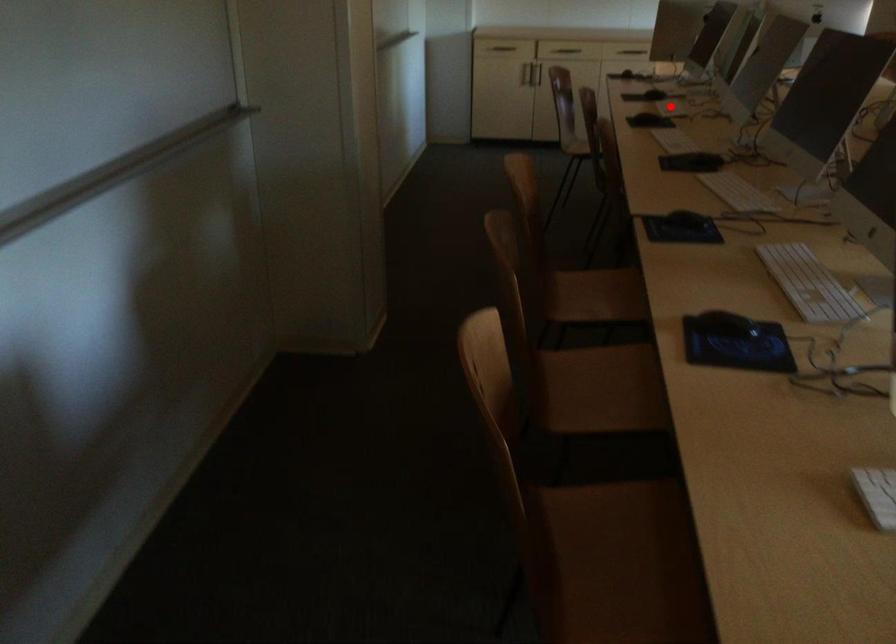
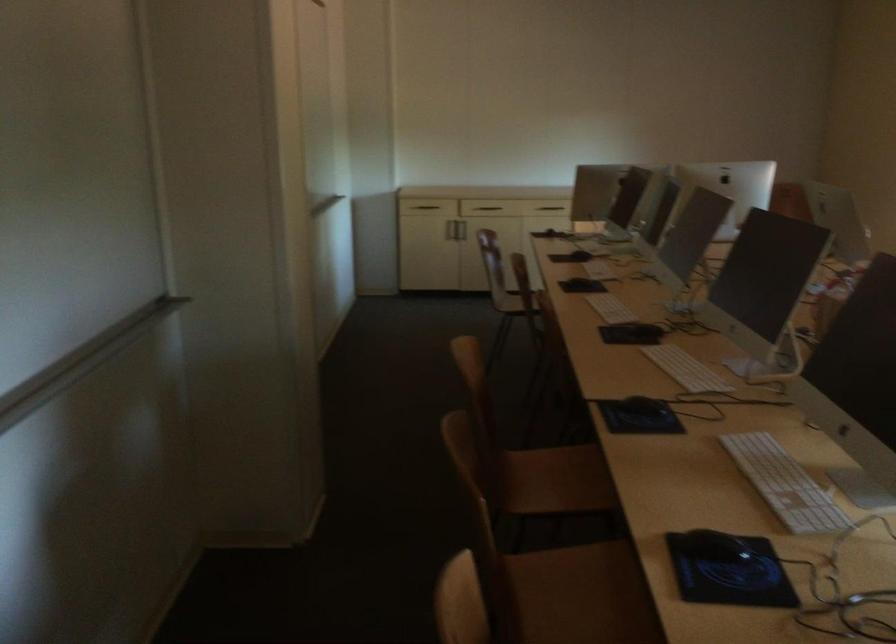
Question: I am providing you with two images of the same scene from different viewpoints. A red point is marked on the first image. Can you still see the location of the red point in image 2?

Choices:
 (A) Yes
 (B) No

Answer: (A)